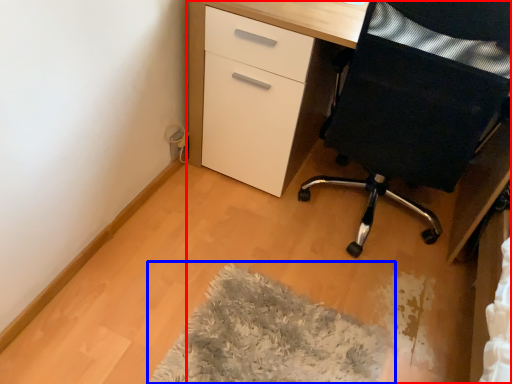
Question: Which of the following is the closest to the observer, desk (highlighted by a red box) or mat (highlighted by a blue box)?

Choices:
 (A) desk
 (B) mat

Answer: (B)